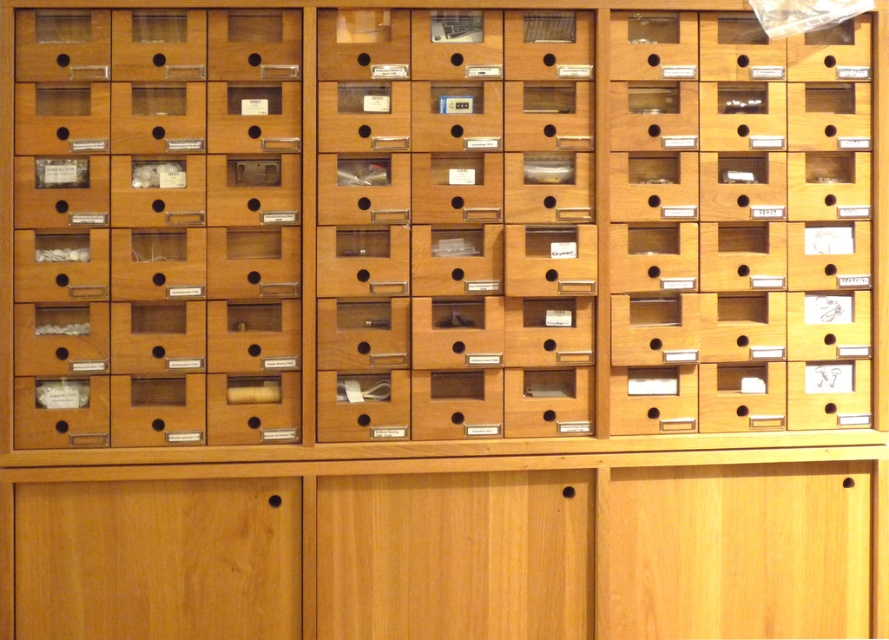
Does wooden drawer at right have a larger size compared to wooden drawer at center?

No.

Does point (877, 323) lie behind point (526, 282)?

Yes, it is.

Locate an element on the screen. This screenshot has height=640, width=889. wooden drawer at right is located at coordinates pyautogui.click(x=754, y=228).

Which of these two, wooden drawer at left or wooden drawer at center, stands shorter?

Answer: wooden drawer at left is shorter.

Is wooden drawer at left positioned before wooden drawer at center?

Yes.

Image resolution: width=889 pixels, height=640 pixels. What do you see at coordinates (155, 241) in the screenshot? I see `wooden drawer at left` at bounding box center [155, 241].

You are a GUI agent. You are given a task and a screenshot of the screen. Output one action in this format:
    pyautogui.click(x=<x>, y=<y>)
    Task: Click on the wooden drawer at left
    This screenshot has height=640, width=889.
    Given the screenshot: What is the action you would take?
    pyautogui.click(x=155, y=241)

Is wooden drawer at left behind wooden drawer at right?

No, wooden drawer at left is in front of wooden drawer at right.

Does point (239, 333) come closer to viewer compared to point (709, 289)?

Yes, point (239, 333) is in front of point (709, 289).

Where is `wooden drawer at left`? The width and height of the screenshot is (889, 640). wooden drawer at left is located at coordinates (155, 241).